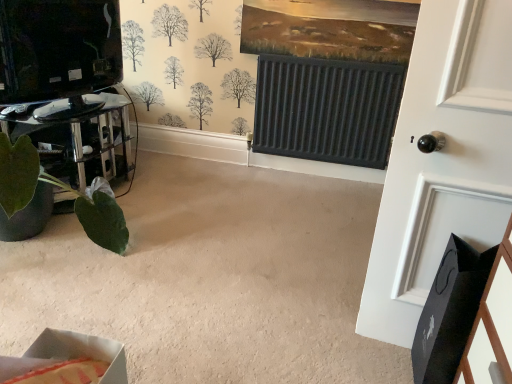
Question: Should I look upward or downward to see cardboard box at lower left?

Choices:
 (A) up
 (B) down

Answer: (B)

Question: Does white matte door at right have a smaller size compared to green matte plant pot at lower left?

Choices:
 (A) no
 (B) yes

Answer: (B)

Question: Does white matte door at right appear on the left side of green matte plant pot at lower left?

Choices:
 (A) yes
 (B) no

Answer: (B)

Question: Is white matte door at right positioned beyond the bounds of green matte plant pot at lower left?

Choices:
 (A) yes
 (B) no

Answer: (A)

Question: From the image's perspective, would you say white matte door at right is positioned over green matte plant pot at lower left?

Choices:
 (A) no
 (B) yes

Answer: (A)

Question: Does white matte door at right appear on the right side of green matte plant pot at lower left?

Choices:
 (A) yes
 (B) no

Answer: (A)

Question: Can you confirm if white matte door at right is thinner than green matte plant pot at lower left?

Choices:
 (A) yes
 (B) no

Answer: (A)

Question: Does cardboard box at lower left have a smaller size compared to white matte door at right?

Choices:
 (A) yes
 (B) no

Answer: (A)

Question: Can you confirm if cardboard box at lower left is wider than white matte door at right?

Choices:
 (A) no
 (B) yes

Answer: (B)

Question: Would you say cardboard box at lower left contains white matte door at right?

Choices:
 (A) no
 (B) yes

Answer: (A)

Question: Is cardboard box at lower left further to camera compared to white matte door at right?

Choices:
 (A) yes
 (B) no

Answer: (B)

Question: Can you confirm if cardboard box at lower left is shorter than white matte door at right?

Choices:
 (A) no
 (B) yes

Answer: (B)

Question: From the image's perspective, does cardboard box at lower left appear higher than white matte door at right?

Choices:
 (A) yes
 (B) no

Answer: (B)

Question: Is the position of green matte plant pot at lower left less distant than that of cardboard box at lower left?

Choices:
 (A) no
 (B) yes

Answer: (A)